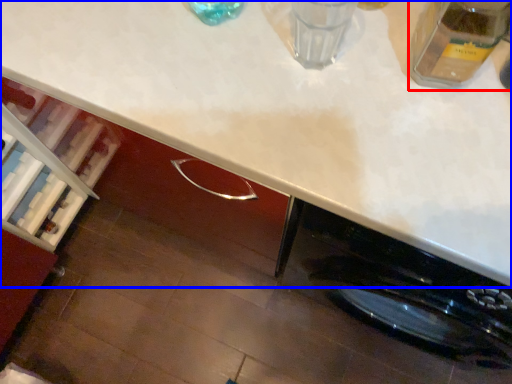
Question: Which of the following is the closest to the observer, glass jar (highlighted by a red box) or countertop (highlighted by a blue box)?

Choices:
 (A) glass jar
 (B) countertop

Answer: (B)